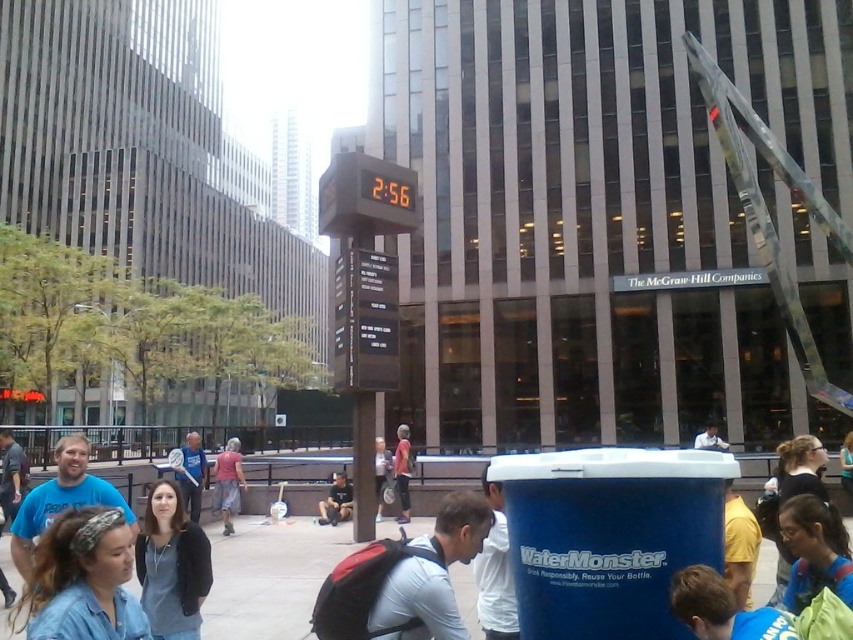
Question: Estimate the real-world distances between objects in this image. Which object is farther from the pink fabric shorts at center?

Choices:
 (A) reddish-pink fabric pants at center
 (B) light blue shirt at center

Answer: (B)

Question: Does blue plastic container at center appear on the right side of dark gray sweater at center?

Choices:
 (A) no
 (B) yes

Answer: (B)

Question: Is pink fabric shorts at center bigger than reddish-pink fabric pants at center?

Choices:
 (A) yes
 (B) no

Answer: (A)

Question: Does white matte water cooler at lower right have a lesser width compared to pink fabric shorts at center?

Choices:
 (A) yes
 (B) no

Answer: (A)

Question: Which point is farther to the camera?

Choices:
 (A) (231, 444)
 (B) (801, 609)
 (C) (328, 513)

Answer: (A)

Question: Which point is closer to the camera?

Choices:
 (A) (485, 595)
 (B) (380, 493)
 (C) (167, 589)
 (D) (76, 604)

Answer: (D)